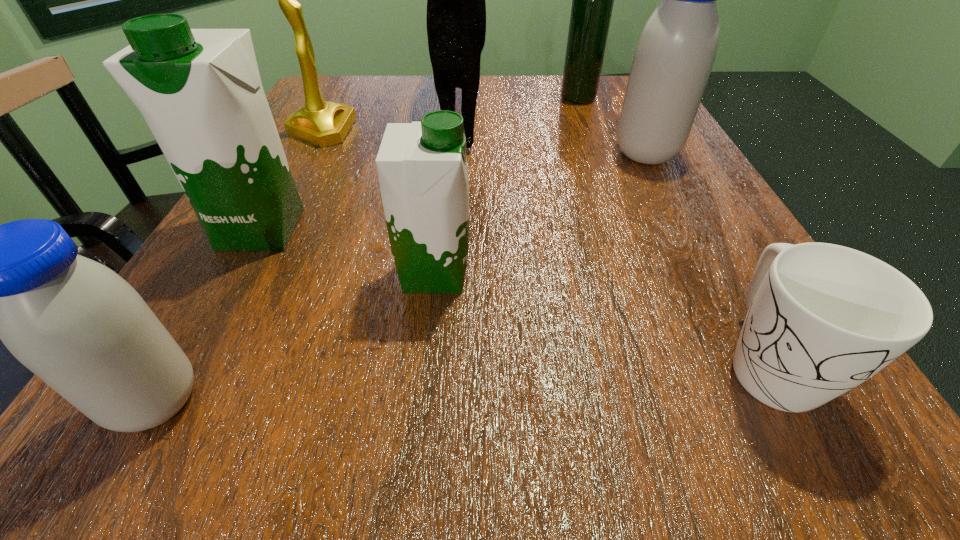
Locate an element on the screen. Image resolution: width=960 pixels, height=540 pixels. object at the near right corner is located at coordinates (822, 318).

In the image, there is a desktop. At what (x,y) coordinates should I click in order to perform the action: click on vacant space at the far edge. Please return your answer as a coordinate pair (x, y). Looking at the image, I should click on (494, 100).

You are a GUI agent. You are given a task and a screenshot of the screen. Output one action in this format:
    pyautogui.click(x=<x>, y=<y>)
    Task: Click on the free space at the near edge of the desktop
    
    Given the screenshot: What is the action you would take?
    pyautogui.click(x=372, y=424)

The width and height of the screenshot is (960, 540). Find the location of `vacant space at the left edge of the desktop`. vacant space at the left edge of the desktop is located at coordinates (330, 159).

Identify the location of vacant space at the right edge of the desktop. (675, 282).

In the image, there is a desktop. Where is `vacant region at the far left corner`? Image resolution: width=960 pixels, height=540 pixels. vacant region at the far left corner is located at coordinates (330, 98).

Where is `empty space between the third soya milk from left to right and the liquor`? The width and height of the screenshot is (960, 540). empty space between the third soya milk from left to right and the liquor is located at coordinates (506, 186).

The width and height of the screenshot is (960, 540). I want to click on free space between the bigger green soya milk and the right green soya milk, so click(x=348, y=251).

At what (x,y) coordinates should I click in order to perform the action: click on free space between the shortest object and the green liquor. Please return your answer as a coordinate pair (x, y). Looking at the image, I should click on (672, 230).

The image size is (960, 540). I want to click on vacant area that lies between the left green soya milk and the shortest object, so pyautogui.click(x=514, y=294).